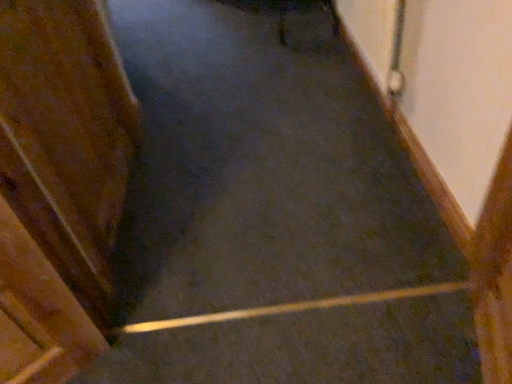
Question: Does smooth concrete stairs at center lie behind wooden door at left?

Choices:
 (A) yes
 (B) no

Answer: (A)

Question: Is the depth of smooth concrete stairs at center less than that of wooden door at left?

Choices:
 (A) yes
 (B) no

Answer: (B)

Question: From a real-world perspective, does smooth concrete stairs at center stand above wooden door at left?

Choices:
 (A) yes
 (B) no

Answer: (B)

Question: From a real-world perspective, is smooth concrete stairs at center located beneath wooden door at left?

Choices:
 (A) yes
 (B) no

Answer: (A)

Question: Could you tell me if smooth concrete stairs at center is turned towards wooden door at left?

Choices:
 (A) no
 (B) yes

Answer: (A)

Question: Would you say smooth concrete stairs at center contains wooden door at left?

Choices:
 (A) yes
 (B) no

Answer: (B)

Question: Is smooth concrete stairs at center surrounded by wooden door at left?

Choices:
 (A) no
 (B) yes

Answer: (A)

Question: Is wooden door at left placed right next to smooth concrete stairs at center?

Choices:
 (A) yes
 (B) no

Answer: (B)

Question: From a real-world perspective, is wooden door at left beneath smooth concrete stairs at center?

Choices:
 (A) no
 (B) yes

Answer: (A)

Question: Would you say wooden door at left is a long distance from smooth concrete stairs at center?

Choices:
 (A) yes
 (B) no

Answer: (B)

Question: From the image's perspective, is wooden door at left above smooth concrete stairs at center?

Choices:
 (A) no
 (B) yes

Answer: (B)

Question: From a real-world perspective, is wooden door at left physically above smooth concrete stairs at center?

Choices:
 (A) yes
 (B) no

Answer: (A)

Question: Is wooden door at left wider or thinner than smooth concrete stairs at center?

Choices:
 (A) wide
 (B) thin

Answer: (B)